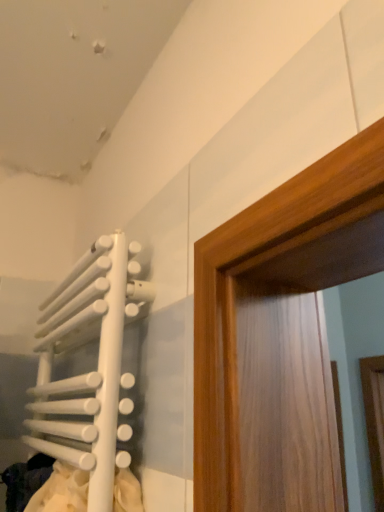
This screenshot has width=384, height=512. What do you see at coordinates (45, 485) in the screenshot?
I see `white matte laundry at lower left` at bounding box center [45, 485].

Find the location of a particular element. white matte laundry at lower left is located at coordinates (45, 485).

What is the approximate height of white matte laundry at lower left?

The height of white matte laundry at lower left is 4.73 inches.

Image resolution: width=384 pixels, height=512 pixels. What do you see at coordinates (88, 383) in the screenshot?
I see `white matte radiator at left` at bounding box center [88, 383].

You are a GUI agent. You are given a task and a screenshot of the screen. Output one action in this format:
    pyautogui.click(x=<x>, y=<y>)
    Task: Click on the white matte radiator at left
    The image size is (384, 512).
    Given the screenshot: What is the action you would take?
    pos(88,383)

Find the location of `white matte laundry at lower left`. white matte laundry at lower left is located at coordinates (45, 485).

Would you say white matte laundry at lower left is to the left or to the right of white matte radiator at left in the picture?

Based on their positions, white matte laundry at lower left is located to the right of white matte radiator at left.

Does white matte laundry at lower left lie in front of white matte radiator at left?

No, white matte laundry at lower left is further to the viewer.

Which is closer to the camera, (x=46, y=465) or (x=72, y=419)?

Point (x=46, y=465).

From the image's perspective, which object appears higher, white matte laundry at lower left or white matte radiator at left?

white matte radiator at left.

From a real-world perspective, which object stands above the other?

white matte radiator at left, from a real-world perspective.

In terms of width, does white matte laundry at lower left look wider or thinner when compared to white matte radiator at left?

Considering their sizes, white matte laundry at lower left looks broader than white matte radiator at left.

In the scene shown: Who is shorter, white matte laundry at lower left or white matte radiator at left?

white matte laundry at lower left.

Can you confirm if white matte laundry at lower left is smaller than white matte radiator at left?

Indeed, white matte laundry at lower left has a smaller size compared to white matte radiator at left.

Looking at this image, is white matte laundry at lower left surrounding white matte radiator at left?

No, white matte radiator at left is not inside white matte laundry at lower left.

Is white matte laundry at lower left in contact with white matte radiator at left?

No.

Consider the image. Is white matte laundry at lower left positioned with its back to white matte radiator at left?

Absolutely, white matte laundry at lower left is directed away from white matte radiator at left.

How many degrees apart are the facing directions of white matte laundry at lower left and white matte radiator at left?

2.02 degrees.

Find the location of a particular element. The height and width of the screenshot is (512, 384). laundry to the right of white matte radiator at left is located at coordinates (45, 485).

In the image, is white matte radiator at left on the left side or the right side of white matte laundry at lower left?

white matte radiator at left is to the left of white matte laundry at lower left.

Which is in front, white matte radiator at left or white matte laundry at lower left?

white matte radiator at left is closer to the camera.

Is point (27, 441) less distant than point (52, 458)?

No, it is behind (52, 458).

From the image's perspective, who appears lower, white matte radiator at left or white matte laundry at lower left?

white matte laundry at lower left is shown below in the image.

From a real-world perspective, is white matte radiator at left located higher than white matte laundry at lower left?

Yes, from a real-world perspective, white matte radiator at left is over white matte laundry at lower left

Considering the relative sizes of white matte radiator at left and white matte laundry at lower left in the image provided, is white matte radiator at left wider than white matte laundry at lower left?

No, white matte radiator at left is not wider than white matte laundry at lower left.

Can you confirm if white matte radiator at left is shorter than white matte laundry at lower left?

No, white matte radiator at left is not shorter than white matte laundry at lower left.

Which of these two, white matte radiator at left or white matte laundry at lower left, is smaller?

With smaller size is white matte laundry at lower left.

Is white matte radiator at left outside of white matte laundry at lower left?

white matte radiator at left is positioned outside white matte laundry at lower left.

Consider the image. Is white matte radiator at left far from white matte laundry at lower left?

No, there isn't a large distance between white matte radiator at left and white matte laundry at lower left.

Is white matte radiator at left turned away from white matte laundry at lower left?

Yes, white matte radiator at left is facing away from white matte laundry at lower left.

Can you tell me how much white matte radiator at left and white matte laundry at lower left differ in facing direction?

white matte radiator at left and white matte laundry at lower left are facing 2.02 degrees away from each other.

How distant is white matte radiator at left from white matte laundry at lower left?

5.87 inches.

The width and height of the screenshot is (384, 512). Find the location of `radiator that is on the left side of white matte laundry at lower left`. radiator that is on the left side of white matte laundry at lower left is located at coordinates (88, 383).

This screenshot has height=512, width=384. What are the coordinates of `laundry below the white matte radiator at left (from the image's perspective)` in the screenshot? It's located at (45, 485).

The width and height of the screenshot is (384, 512). What are the coordinates of `laundry to the right of white matte radiator at left` in the screenshot? It's located at (45, 485).